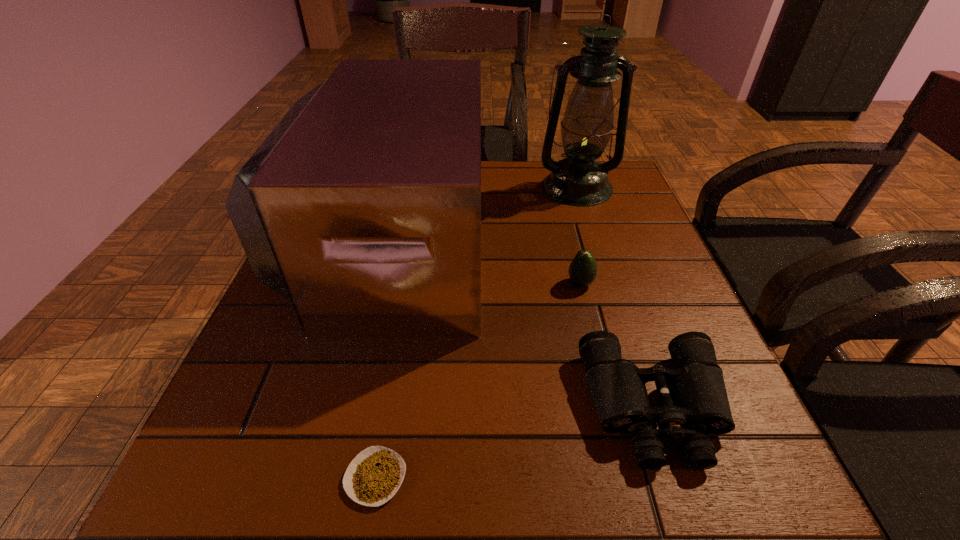
At what (x,y) coordinates should I click in order to perform the action: click on vacant space that's between the avocado and the shortest object. Please return your answer as a coordinate pair (x, y). Looking at the image, I should click on (478, 381).

You are a GUI agent. You are given a task and a screenshot of the screen. Output one action in this format:
    pyautogui.click(x=<x>, y=<y>)
    Task: Click on the fourth closest object to the avocado
    The image size is (960, 540).
    Given the screenshot: What is the action you would take?
    pyautogui.click(x=374, y=476)

Where is `object that is the closest one to the fourth shortest object`? Image resolution: width=960 pixels, height=540 pixels. object that is the closest one to the fourth shortest object is located at coordinates (578, 180).

What are the coordinates of `vacant space that satisfies the following two spatial constraints: 1. on the back side of the avocado; 2. on the front-facing side of the microwave oven` in the screenshot? It's located at (570, 243).

Where is `blank area in the image that satisfies the following two spatial constraints: 1. on the front-facing side of the avocado; 2. on the right side of the fourth shortest object`? blank area in the image that satisfies the following two spatial constraints: 1. on the front-facing side of the avocado; 2. on the right side of the fourth shortest object is located at coordinates (382, 284).

Where is `free spot that satisfies the following two spatial constraints: 1. on the front side of the tallest object; 2. on the front-facing side of the microwave oven`? This screenshot has height=540, width=960. free spot that satisfies the following two spatial constraints: 1. on the front side of the tallest object; 2. on the front-facing side of the microwave oven is located at coordinates 594,243.

The image size is (960, 540). Find the location of `free space in the image that satisfies the following two spatial constraints: 1. on the front-facing side of the fourth shortest object; 2. on the back side of the avocado`. free space in the image that satisfies the following two spatial constraints: 1. on the front-facing side of the fourth shortest object; 2. on the back side of the avocado is located at coordinates (382, 284).